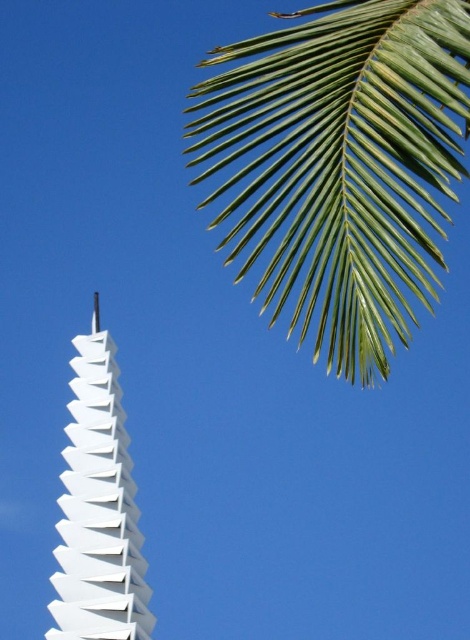
You are standing in front of the modern structure on the left and want to place a small flag at point (380,177) and point (114,604). Which point will require you to climb higher to place the flag?

Point (380,177) is closer to the viewer than point (114,604), so you will need to climb higher to place the flag at point (380,177) because it is closer and likely at a higher elevation.

You are an architect analyzing the image. You need to determine which object is taller between the green leafy palm at upper right and the white matte pyramid at center. Based on the scene, which one is taller?

The white matte pyramid at center is taller than the green leafy palm at upper right according to the description.

You are an architect designing a new sculpture garden. You have two elements to place in the garden layout. The green leafy palm at upper right and the white matte pyramid at center. Given their sizes, which element should you prioritize placing first to ensure proper spacing?

The green leafy palm at upper right should be prioritized since it is larger in size than the white matte pyramid at center, ensuring adequate space is allocated first for the bigger element.